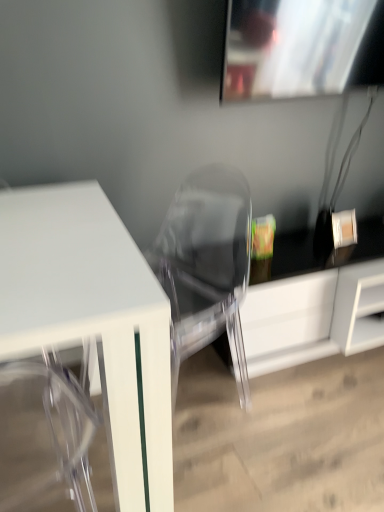
What do you see at coordinates (93, 322) in the screenshot? I see `white glossy table at left` at bounding box center [93, 322].

The height and width of the screenshot is (512, 384). Identify the location of white glossy table at left. (93, 322).

I want to click on white glossy table at left, so (x=93, y=322).